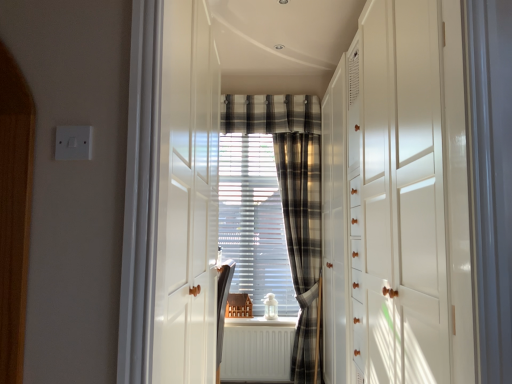
Question: Is white glossy dresser at right to the right of white matte radiator at center from the viewer's perspective?

Choices:
 (A) yes
 (B) no

Answer: (A)

Question: Considering the relative sizes of white glossy dresser at right and white matte radiator at center in the image provided, is white glossy dresser at right shorter than white matte radiator at center?

Choices:
 (A) yes
 (B) no

Answer: (B)

Question: From the image's perspective, does white glossy dresser at right appear lower than white matte radiator at center?

Choices:
 (A) no
 (B) yes

Answer: (A)

Question: Is white glossy dresser at right aimed at white matte radiator at center?

Choices:
 (A) no
 (B) yes

Answer: (B)

Question: Is white glossy dresser at right far away from white matte radiator at center?

Choices:
 (A) no
 (B) yes

Answer: (B)

Question: From a real-world perspective, is plaid fabric at center above or below plaid fabric curtain at center?

Choices:
 (A) above
 (B) below

Answer: (A)

Question: Choose the correct answer: Is plaid fabric at center inside plaid fabric curtain at center or outside it?

Choices:
 (A) inside
 (B) outside

Answer: (B)

Question: Is plaid fabric at center taller or shorter than plaid fabric curtain at center?

Choices:
 (A) tall
 (B) short

Answer: (B)

Question: Based on their sizes in the image, would you say plaid fabric at center is bigger or smaller than plaid fabric curtain at center?

Choices:
 (A) big
 (B) small

Answer: (B)

Question: In the image, is plaid fabric curtain at center positioned in front of or behind white glossy dresser at right?

Choices:
 (A) front
 (B) behind

Answer: (B)

Question: Is plaid fabric curtain at center inside the boundaries of white glossy dresser at right, or outside?

Choices:
 (A) inside
 (B) outside

Answer: (B)

Question: In terms of width, does plaid fabric curtain at center look wider or thinner when compared to white glossy dresser at right?

Choices:
 (A) thin
 (B) wide

Answer: (A)

Question: In the image, is plaid fabric curtain at center on the left side or the right side of white glossy dresser at right?

Choices:
 (A) right
 (B) left

Answer: (B)

Question: From the image's perspective, is plaid fabric curtain at center above or below plaid fabric at center?

Choices:
 (A) below
 (B) above

Answer: (A)

Question: Considering the positions of point (316, 226) and point (275, 112), is point (316, 226) closer or farther from the camera than point (275, 112)?

Choices:
 (A) farther
 (B) closer

Answer: (B)